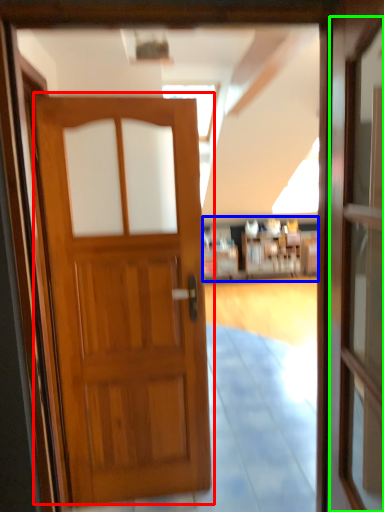
Question: Which object is the farthest from door (highlighted by a red box)? Choose among these: hotel lobby (highlighted by a blue box) or screen door (highlighted by a green box).

Choices:
 (A) hotel lobby
 (B) screen door

Answer: (A)